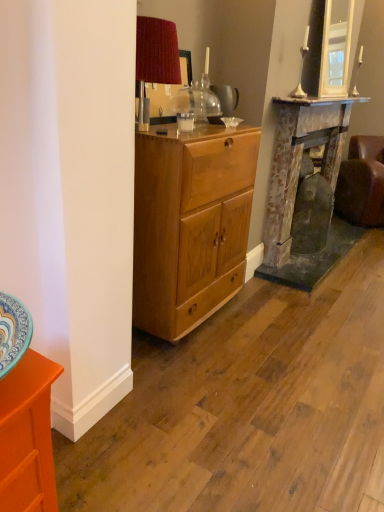
Measure the distance between point (379, 224) and camera.

4.08 meters.

Find the location of a particular element. The image size is (384, 512). brown leather couch at right is located at coordinates (362, 182).

This screenshot has width=384, height=512. What do you see at coordinates (357, 72) in the screenshot? I see `silver metallic candle holder at upper right` at bounding box center [357, 72].

This screenshot has height=512, width=384. What do you see at coordinates (190, 225) in the screenshot? I see `light brown wood cabinet at center` at bounding box center [190, 225].

Locate an element on the screen. Image resolution: width=384 pixels, height=512 pixels. orange glossy cabinet at lower left is located at coordinates (27, 436).

Where is `brown leather couch at right`? brown leather couch at right is located at coordinates (362, 182).

From the image's perspective, which one is positioned lower, orange glossy cabinet at lower left or light brown wood cabinet at center?

orange glossy cabinet at lower left.

Considering the sizes of objects orange glossy cabinet at lower left and light brown wood cabinet at center in the image provided, who is bigger, orange glossy cabinet at lower left or light brown wood cabinet at center?

With larger size is light brown wood cabinet at center.

Does orange glossy cabinet at lower left have a lesser height compared to light brown wood cabinet at center?

Indeed, orange glossy cabinet at lower left has a lesser height compared to light brown wood cabinet at center.

Is translucent glass teapot at center beside clear glass coffee cup at center?

No, translucent glass teapot at center is not making contact with clear glass coffee cup at center.

From the image's perspective, which one is positioned higher, translucent glass teapot at center or clear glass coffee cup at center?

translucent glass teapot at center appears higher in the image.

Who is more distant, translucent glass teapot at center or clear glass coffee cup at center?

Positioned behind is translucent glass teapot at center.

Which is more to the left, clear glass coffee cup at center or light brown wood cabinet at center?

Positioned to the left is light brown wood cabinet at center.

Where is `desk below the clear glass coffee cup at center (from the image's perspective)`? The image size is (384, 512). desk below the clear glass coffee cup at center (from the image's perspective) is located at coordinates (190, 225).

Is clear glass coffee cup at center turned away from light brown wood cabinet at center?

No, clear glass coffee cup at center's orientation is not away from light brown wood cabinet at center.

From a real-world perspective, is clear glass coffee cup at center above or below light brown wood cabinet at center?

clear glass coffee cup at center is above light brown wood cabinet at center.

From the image's perspective, is silver metallic candle holder at upper right located above or below clear glass coffee cup at center?

From the image's perspective, silver metallic candle holder at upper right appears above clear glass coffee cup at center.

Locate an element on the screen. This screenshot has width=384, height=512. candle holder that is above the clear glass coffee cup at center (from a real-world perspective) is located at coordinates (357, 72).

Considering the relative sizes of silver metallic candle holder at upper right and clear glass coffee cup at center in the image provided, is silver metallic candle holder at upper right bigger than clear glass coffee cup at center?

Yes, silver metallic candle holder at upper right is bigger than clear glass coffee cup at center.

Is silver metallic candle holder at upper right oriented towards clear glass coffee cup at center?

No.

Which point is more distant from viewer, (24, 483) or (355, 88)?

Positioned behind is point (355, 88).

From the image's perspective, which object appears higher, orange glossy cabinet at lower left or silver metallic candle holder at upper right?

silver metallic candle holder at upper right appears higher in the image.

How different are the orientations of orange glossy cabinet at lower left and silver metallic candle holder at upper right in degrees?

4.1 degrees separate the facing orientations of orange glossy cabinet at lower left and silver metallic candle holder at upper right.

Which of these two, orange glossy cabinet at lower left or silver metallic candle holder at upper right, is smaller?

With smaller size is silver metallic candle holder at upper right.

Does translucent glass teapot at center lie in front of light brown wood cabinet at center?

No, translucent glass teapot at center is further to the viewer.

Does point (225, 103) appear closer or farther from the camera than point (141, 280)?

Point (225, 103) appears to be farther away from the viewer than point (141, 280).

Is translucent glass teapot at center not near light brown wood cabinet at center?

No, translucent glass teapot at center is not far from light brown wood cabinet at center.

Is light brown wood cabinet at center completely or partially inside translucent glass teapot at center?

No, translucent glass teapot at center does not contain light brown wood cabinet at center.

Is silver metallic candle holder at upper right at the right side of rusty metal fireplace at right?

Indeed, silver metallic candle holder at upper right is positioned on the right side of rusty metal fireplace at right.

Which object is further away from the camera, silver metallic candle holder at upper right or rusty metal fireplace at right?

silver metallic candle holder at upper right is further away from the camera.

Which of these two, silver metallic candle holder at upper right or rusty metal fireplace at right, stands shorter?

With less height is silver metallic candle holder at upper right.

From the image's perspective, between silver metallic candle holder at upper right and rusty metal fireplace at right, who is located below?

From the image's view, rusty metal fireplace at right is below.

Find the location of a particular element. cabinetry on the left side of light brown wood cabinet at center is located at coordinates (27, 436).

The height and width of the screenshot is (512, 384). Identify the location of teapot above the clear glass coffee cup at center (from the image's perspective). (226, 98).

Considering their positions, is translucent glass teapot at center positioned further to silver metallic candle holder at upper right than clear glass coffee cup at center?

The object further to silver metallic candle holder at upper right is clear glass coffee cup at center.

When comparing their distances from rusty metal fireplace at right, does brown leather couch at right or silver metallic candle holder at upper right seem closer?

brown leather couch at right.

Looking at this image, based on their spatial positions, is light brown wood cabinet at center or silver metallic candle holder at upper right further from clear glass coffee cup at center?

silver metallic candle holder at upper right is positioned further to the anchor clear glass coffee cup at center.

Considering their positions, is translucent glass teapot at center positioned further to light brown wood cabinet at center than silver metallic candle holder at upper right?

silver metallic candle holder at upper right is further to light brown wood cabinet at center.

Looking at the image, which one is located further to orange glossy cabinet at lower left, brown leather couch at right or rusty metal fireplace at right?

Based on the image, brown leather couch at right appears to be further to orange glossy cabinet at lower left.

Based on their spatial positions, is orange glossy cabinet at lower left or clear glass coffee cup at center closer to translucent glass teapot at center?

clear glass coffee cup at center is closer to translucent glass teapot at center.

Looking at the image, which one is located further to clear glass coffee cup at center, translucent glass teapot at center or brown leather couch at right?

Based on the image, brown leather couch at right appears to be further to clear glass coffee cup at center.

Looking at the image, which one is located further to light brown wood cabinet at center, silver metallic candle holder at upper right or clear glass coffee cup at center?

silver metallic candle holder at upper right lies further to light brown wood cabinet at center than the other object.

What are the coordinates of `fireplace between light brown wood cabinet at center and brown leather couch at right along the z-axis` in the screenshot? It's located at (303, 190).

This screenshot has width=384, height=512. Identify the location of desk positioned between orange glossy cabinet at lower left and silver metallic candle holder at upper right from near to far. (190, 225).

Find the location of a particular element. This screenshot has width=384, height=512. fireplace between light brown wood cabinet at center and silver metallic candle holder at upper right along the z-axis is located at coordinates (303, 190).

You are a GUI agent. You are given a task and a screenshot of the screen. Output one action in this format:
    pyautogui.click(x=<x>, y=<y>)
    Task: Click on the teapot between clear glass coffee cup at center and silver metallic candle holder at upper right in the front-back direction
    This screenshot has width=384, height=512.
    Given the screenshot: What is the action you would take?
    tap(226, 98)